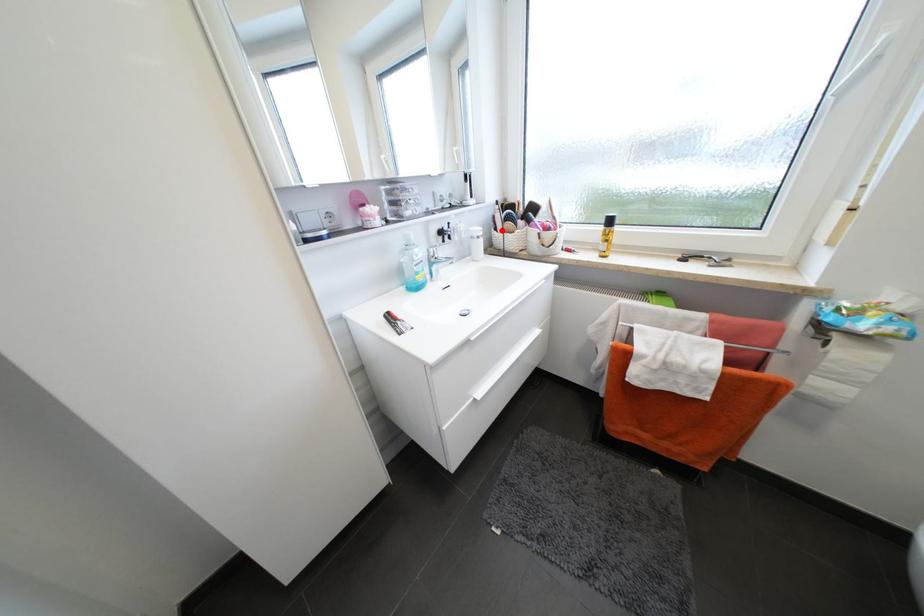
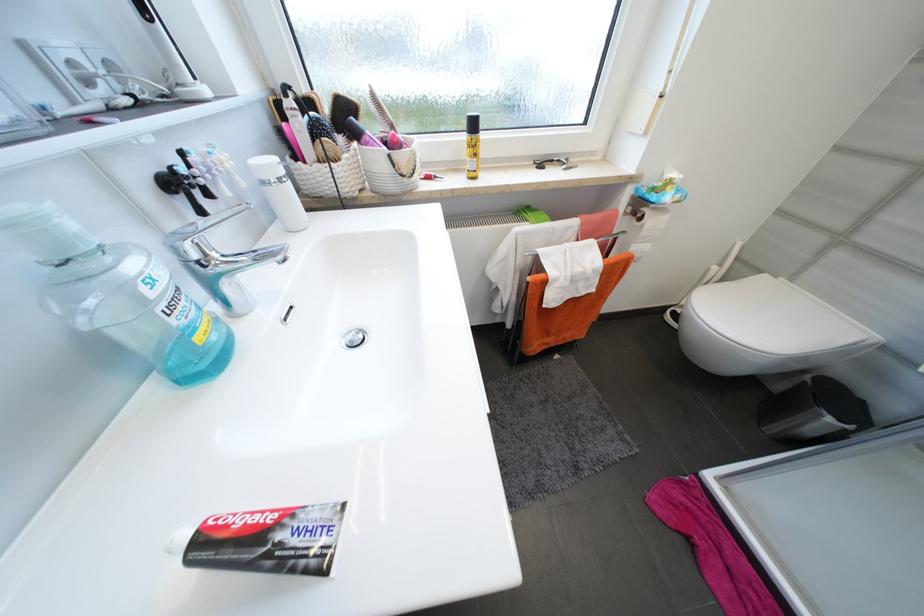
Find the pixel in the second image that matches the highlighted location in the first image.

(304, 158)